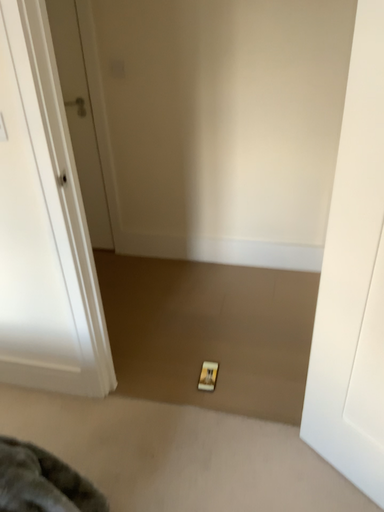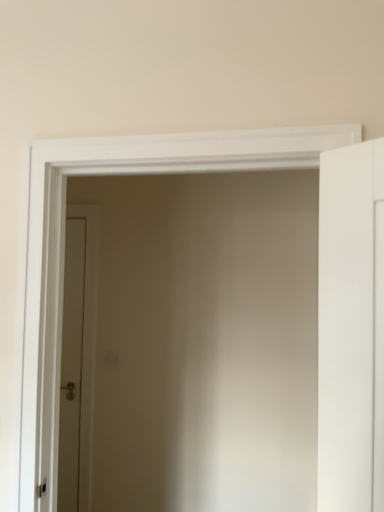
Question: Which way did the camera rotate in the video?

Choices:
 (A) rotated downward
 (B) rotated upward

Answer: (B)